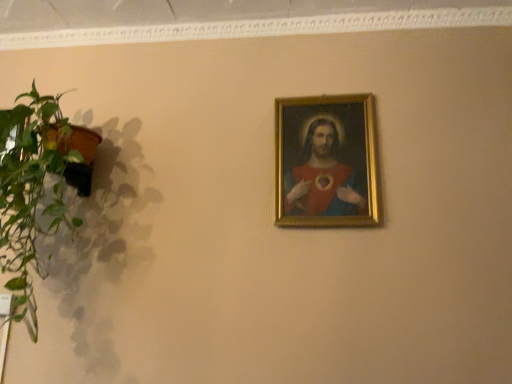
What do you see at coordinates (31, 193) in the screenshot?
I see `green leafy plant at left` at bounding box center [31, 193].

This screenshot has width=512, height=384. Find the location of `green leafy plant at left`. green leafy plant at left is located at coordinates (x=31, y=193).

At what (x,y) coordinates should I click in order to perform the action: click on matte gold frame at upper center. Please return your answer as a coordinate pair (x, y). Image resolution: width=512 pixels, height=384 pixels. Looking at the image, I should click on (322, 177).

What do you see at coordinates (322, 177) in the screenshot? I see `matte gold frame at upper center` at bounding box center [322, 177].

This screenshot has width=512, height=384. I want to click on green leafy plant at left, so click(x=31, y=193).

In the image, is green leafy plant at left on the left side or the right side of matte gold frame at upper center?

Clearly, green leafy plant at left is on the left of matte gold frame at upper center in the image.

Is green leafy plant at left behind matte gold frame at upper center?

No, green leafy plant at left is in front of matte gold frame at upper center.

Considering the positions of points (12, 160) and (313, 188), is point (12, 160) farther from camera compared to point (313, 188)?

No, (12, 160) is in front of (313, 188).

From the image's perspective, relative to matte gold frame at upper center, is green leafy plant at left above or below?

From the image's perspective, green leafy plant at left appears below matte gold frame at upper center.

From a real-world perspective, is green leafy plant at left above or below matte gold frame at upper center?

green leafy plant at left is below matte gold frame at upper center.

Which object is thinner, green leafy plant at left or matte gold frame at upper center?

Thinner between the two is matte gold frame at upper center.

Considering the sizes of green leafy plant at left and matte gold frame at upper center in the image, is green leafy plant at left taller or shorter than matte gold frame at upper center?

Clearly, green leafy plant at left is taller compared to matte gold frame at upper center.

Is green leafy plant at left bigger than matte gold frame at upper center?

Yes, green leafy plant at left is bigger than matte gold frame at upper center.

Can we say green leafy plant at left lies outside matte gold frame at upper center?

Yes, green leafy plant at left is located beyond the bounds of matte gold frame at upper center.

Is green leafy plant at left far away from matte gold frame at upper center?

green leafy plant at left is near matte gold frame at upper center, not far away.

Is green leafy plant at left positioned with its back to matte gold frame at upper center?

No, green leafy plant at left is not facing away from matte gold frame at upper center.

Locate an element on the screen. Image resolution: width=512 pixels, height=384 pixels. houseplant below the matte gold frame at upper center (from a real-world perspective) is located at coordinates (31, 193).

Is matte gold frame at upper center at the left side of green leafy plant at left?

No.

Is matte gold frame at upper center behind green leafy plant at left?

Yes, matte gold frame at upper center is further from the viewer.

Which point is more forward, (303,208) or (25,205)?

The point (25,205) is closer.

From the image's perspective, would you say matte gold frame at upper center is positioned over green leafy plant at left?

Yes, from the image's perspective, matte gold frame at upper center is on top of green leafy plant at left.

From a real-world perspective, does matte gold frame at upper center sit lower than green leafy plant at left?

No, from a real-world perspective, matte gold frame at upper center is not under green leafy plant at left.

Is matte gold frame at upper center thinner than green leafy plant at left?

Yes, matte gold frame at upper center is thinner than green leafy plant at left.

Considering the sizes of matte gold frame at upper center and green leafy plant at left in the image, is matte gold frame at upper center taller or shorter than green leafy plant at left?

In the image, matte gold frame at upper center appears to be shorter than green leafy plant at left.

Considering the sizes of objects matte gold frame at upper center and green leafy plant at left in the image provided, who is smaller, matte gold frame at upper center or green leafy plant at left?

With smaller size is matte gold frame at upper center.

Do you think matte gold frame at upper center is within green leafy plant at left, or outside of it?

matte gold frame at upper center is spatially situated outside green leafy plant at left.

Can you see matte gold frame at upper center touching green leafy plant at left?

matte gold frame at upper center and green leafy plant at left are not in contact.

Is matte gold frame at upper center oriented towards green leafy plant at left?

No, matte gold frame at upper center is not aimed at green leafy plant at left.

Find the location of a particular element. Image resolution: width=512 pixels, height=384 pixels. houseplant beneath the matte gold frame at upper center (from a real-world perspective) is located at coordinates (31, 193).

I want to click on person behind the green leafy plant at left, so click(322, 177).

Image resolution: width=512 pixels, height=384 pixels. I want to click on houseplant that is in front of the matte gold frame at upper center, so point(31,193).